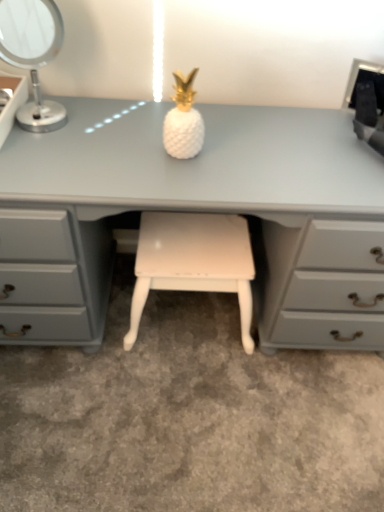
Find the location of a particular element. vacant area located to the right-hand side of white glossy pineapple at center is located at coordinates (244, 156).